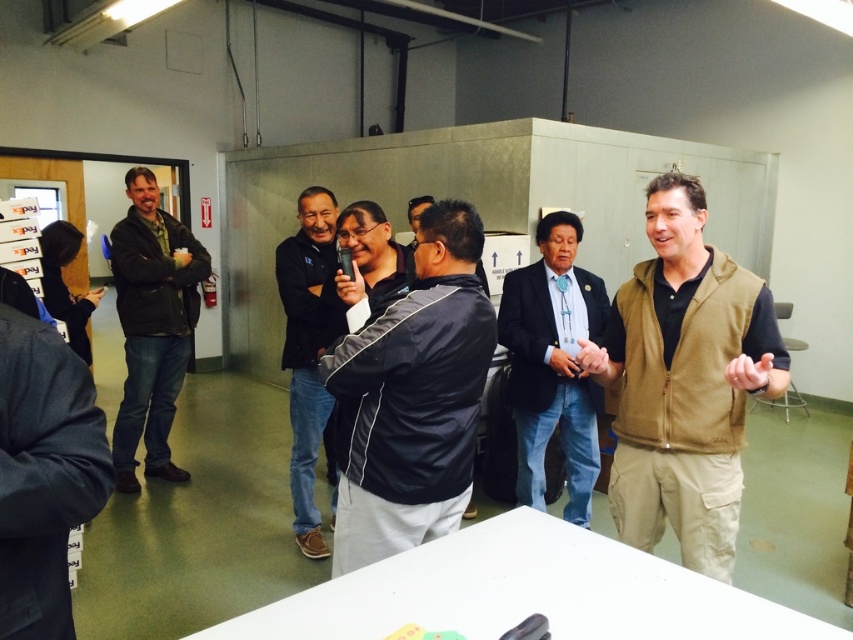
Question: Does tan fleece vest at center appear under white glossy table at lower center?

Choices:
 (A) yes
 (B) no

Answer: (B)

Question: Which object appears closest to the camera in this image?

Choices:
 (A) dark brown leather jacket at left
 (B) tan fleece vest at center

Answer: (B)

Question: Estimate the real-world distances between objects in this image. Which object is closer to the dark brown leather jacket at left?

Choices:
 (A) tan fleece vest at center
 (B) white glossy table at lower center
 (C) blue denim jeans at center

Answer: (C)

Question: Does black matte jacket at center appear on the left side of dark blue jacket at center?

Choices:
 (A) yes
 (B) no

Answer: (B)

Question: Does white glossy table at lower center appear on the right side of black matte jacket at center?

Choices:
 (A) no
 (B) yes

Answer: (B)

Question: Which point appears closest to the camera in this image?

Choices:
 (A) (527, 435)
 (B) (126, 392)
 (C) (395, 372)
 (D) (314, 364)

Answer: (C)